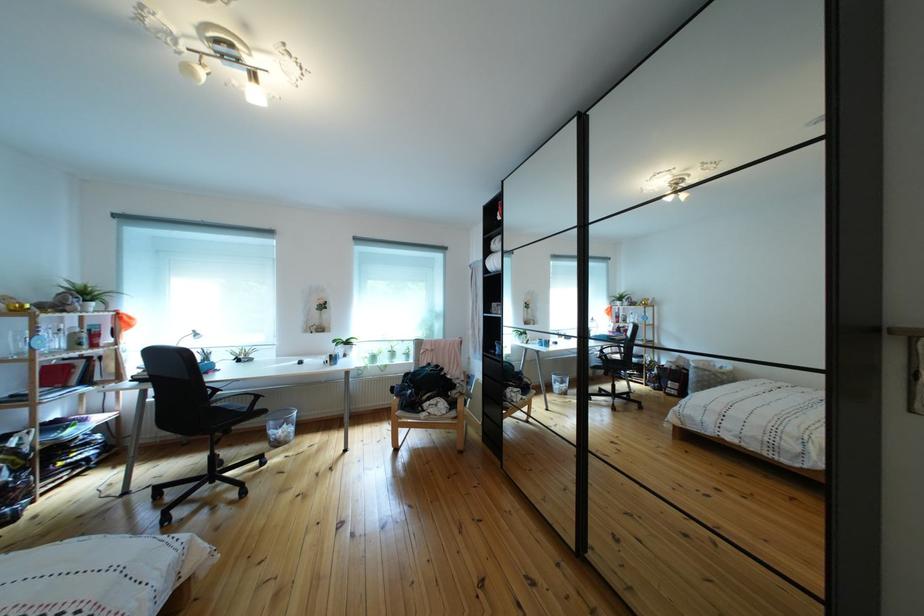
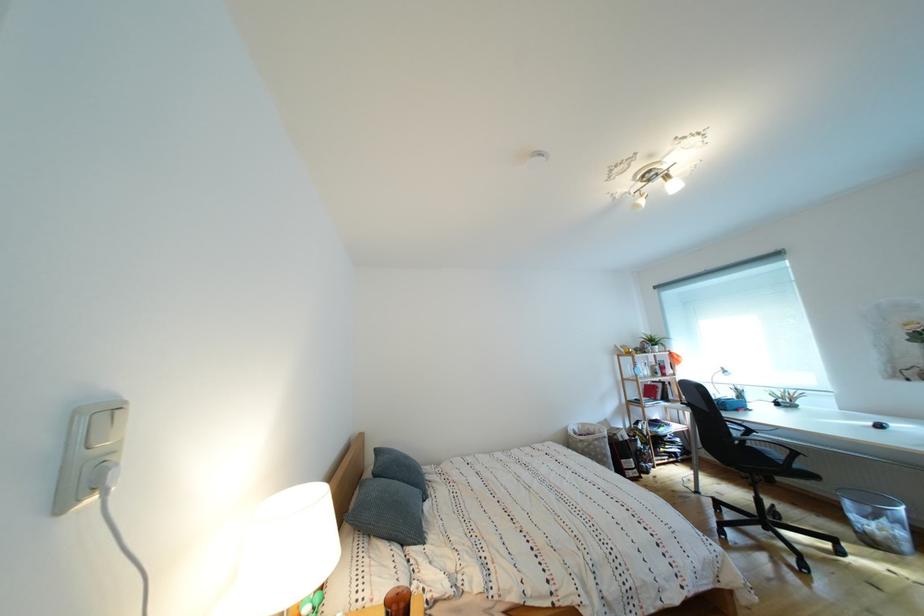
In the second image, find the point that corresponds to the point at 268,414 in the first image.

(808, 472)